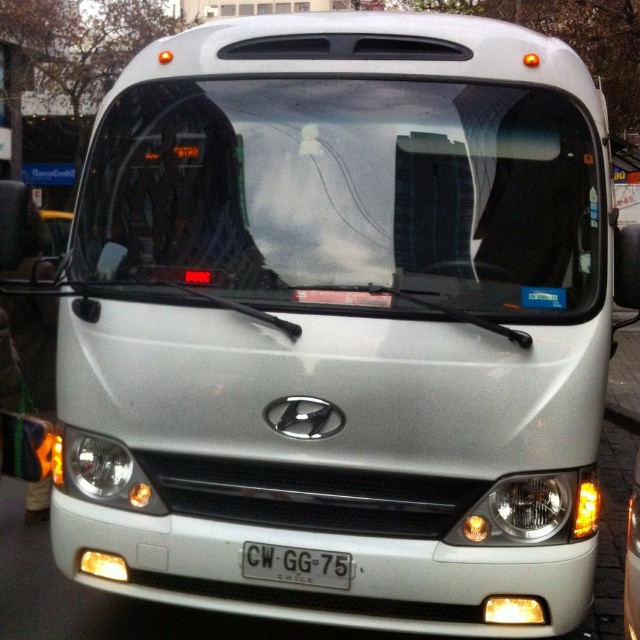
You are a bus driver who needs to check the reflection on the clear glass windshield at center and the matte white headlight at center. Which object allows you to see the tall building reflection more clearly?

The clear glass windshield at center allows you to see the tall building reflection more clearly because it is larger in size than the matte white headlight at center.